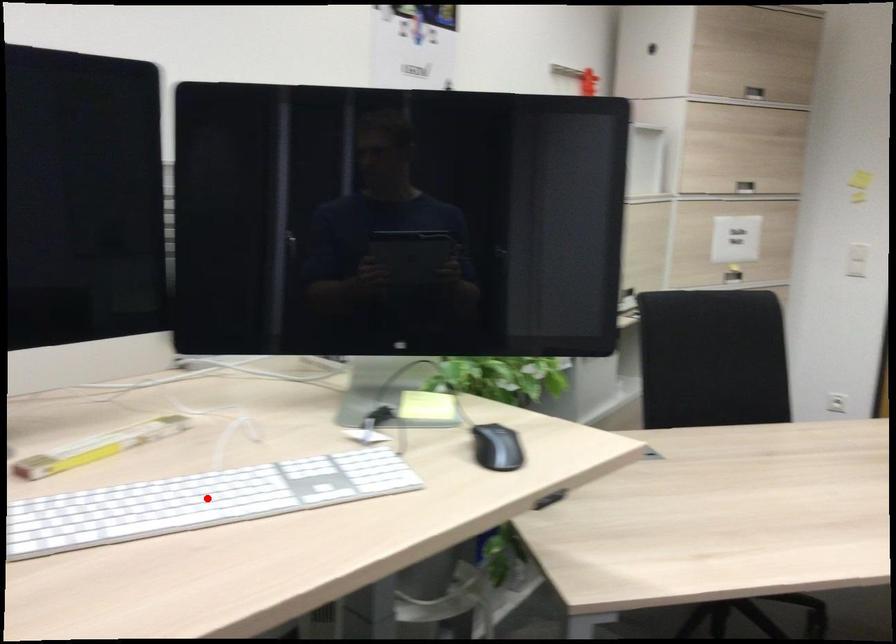
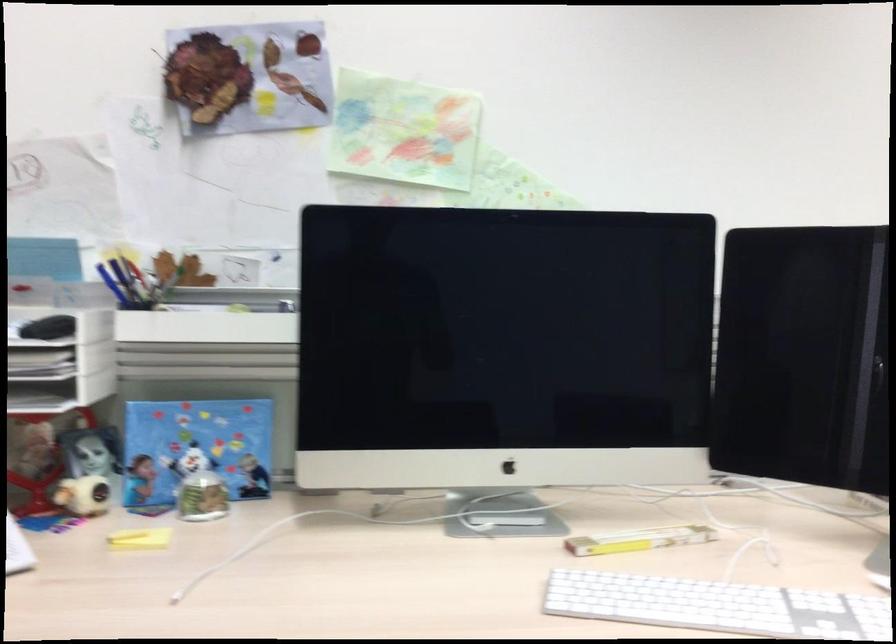
Question: I am providing you with two images of the same scene from different viewpoints. A red point is marked on the first image. At the location where the point appears in image 1, is it still visible in image 2?

Choices:
 (A) Yes
 (B) No

Answer: (A)